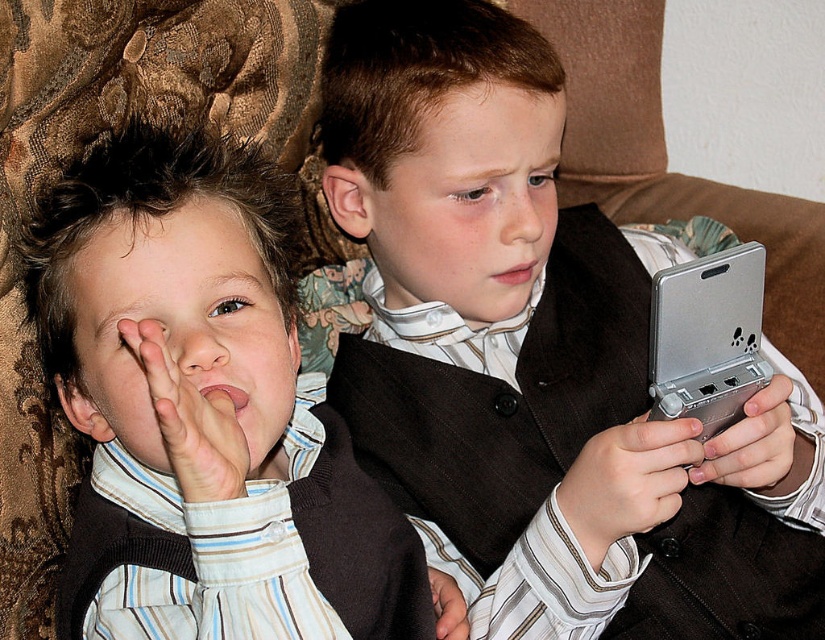
You are a photographer trying to capture a candid shot of the two boys. You want to frame the scene so that the matte brown vest at left and the metallic silver controller at right are both visible. Based on their positions, which object should be placed closer to the left edge of the frame?

The matte brown vest at left should be placed closer to the left edge of the frame since it is positioned to the left of the metallic silver controller at right.

In the scene shown: You are taking a photo of two boys sitting on a floral couch. You notice two points marked on the image at coordinates point (552, 573) and point (430, 588). Which point is closer to the camera?

Point (552, 573) is closer to the camera than point (430, 588).

You are a tailor who needs to adjust the length of two vests. You see the matte black vest at center and the matte brown vest at left. Which vest requires a shorter hem to match the other?

The matte black vest at center is taller than the matte brown vest at left, so the matte black vest at center requires a shorter hem to match the matte brown vest at left.